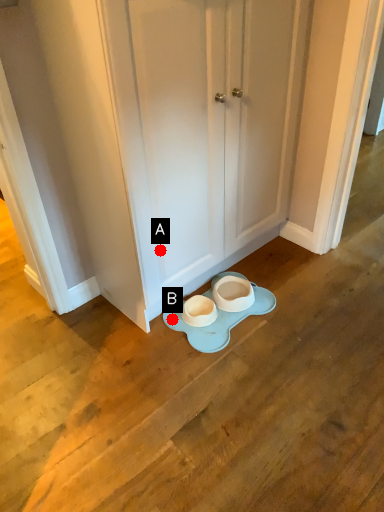
Question: Two points are circled on the image, labeled by A and B beside each circle. Which point appears closest to the camera in this image?

Choices:
 (A) A is closer
 (B) B is closer

Answer: (A)